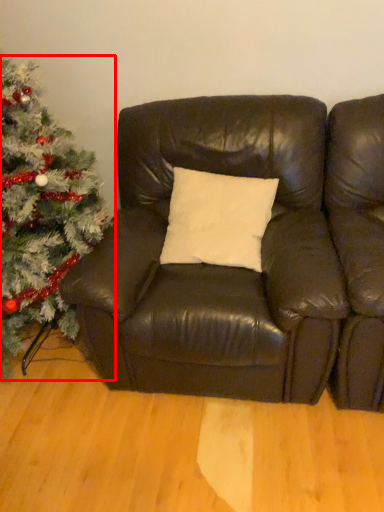
Question: From the image's perspective, what is the correct spatial relationship of christmas tree (annotated by the red box) in relation to studio couch?

Choices:
 (A) above
 (B) below

Answer: (A)